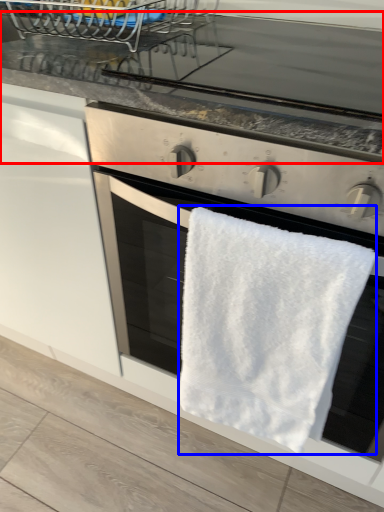
Question: Which point is further to the camera, countertop (highlighted by a red box) or towel/napkin (highlighted by a blue box)?

Choices:
 (A) countertop
 (B) towel/napkin

Answer: (A)